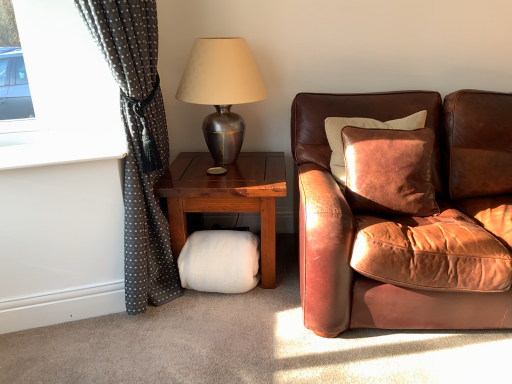
At what (x,y) coordinates should I click in order to perform the action: click on empty space that is ontop of white fluffy pillow at lower center (from a real-world perspective). Please return your answer as a coordinate pair (x, y). This screenshot has width=512, height=384. Looking at the image, I should click on (225, 168).